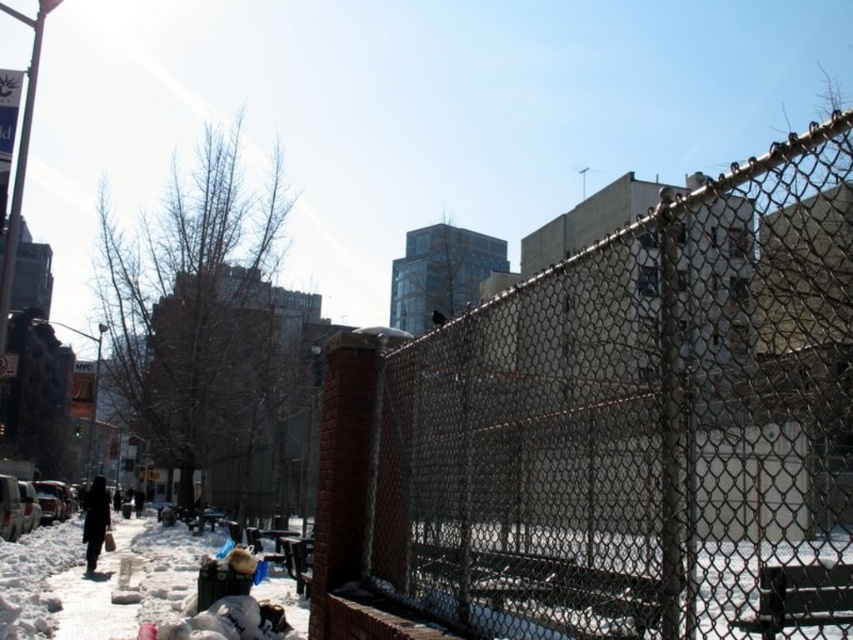
Question: Which object is positioned farthest from the dark brown coat at lower left?

Choices:
 (A) metallic chain-link fence at center
 (B) black metal park bench at center
 (C) snowy concrete sidewalk at lower left

Answer: (A)

Question: Does metallic chain-link fence at center appear under dark brown coat at lower left?

Choices:
 (A) yes
 (B) no

Answer: (B)

Question: Among these points, which one is farthest from the camera?

Choices:
 (A) [824, 573]
 (B) [85, 532]
 (C) [426, 557]

Answer: (B)

Question: Can you confirm if metallic chain-link fence at center is wider than dark brown coat at lower left?

Choices:
 (A) no
 (B) yes

Answer: (B)

Question: Which point is farther from the camera taking this photo?

Choices:
 (A) (814, 595)
 (B) (674, 285)

Answer: (A)

Question: Is metallic chain-link fence at center positioned at the back of black metal park bench at center?

Choices:
 (A) yes
 (B) no

Answer: (B)